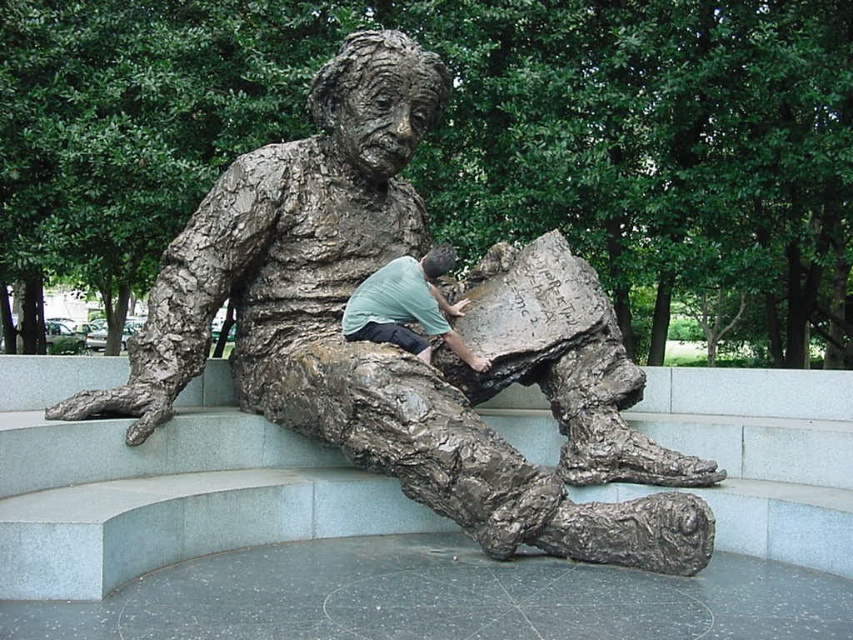
Question: Which of the following is the closest to the observer?

Choices:
 (A) (363, 298)
 (B) (358, 90)

Answer: (A)

Question: Which object is farther from the camera taking this photo?

Choices:
 (A) bronze statue at center
 (B) green matte shirt at center

Answer: (B)

Question: Is bronze statue at center behind green matte shirt at center?

Choices:
 (A) no
 (B) yes

Answer: (A)

Question: Does bronze statue at center come in front of green matte shirt at center?

Choices:
 (A) no
 (B) yes

Answer: (B)

Question: Does bronze statue at center lie in front of green matte shirt at center?

Choices:
 (A) no
 (B) yes

Answer: (B)